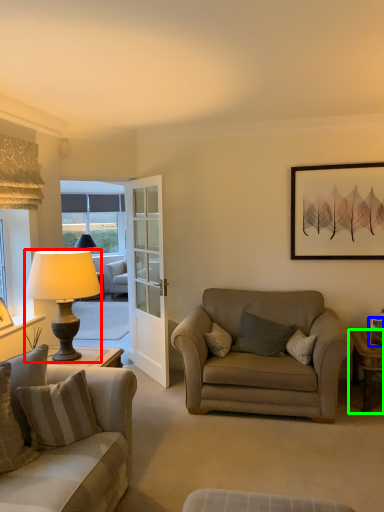
Question: Estimate the real-world distances between objects in this image. Which object is farther from lamp (highlighted by a red box), picture frame (highlighted by a blue box) or desk (highlighted by a green box)?

Choices:
 (A) picture frame
 (B) desk

Answer: (A)